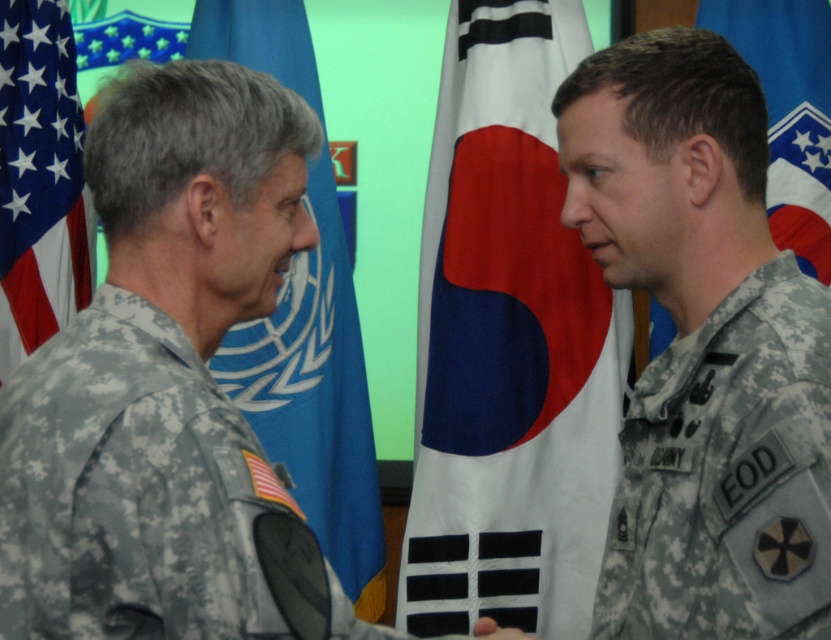
You are a photographer at the scene. You need to capture a photo where the blue fabric flag at left and the smooth skin hand at center are both visible. Based on their positions, which object is closer to the left edge of the photo?

The blue fabric flag at left is closer to the left edge of the photo because it is positioned to the left of the smooth skin hand at center.